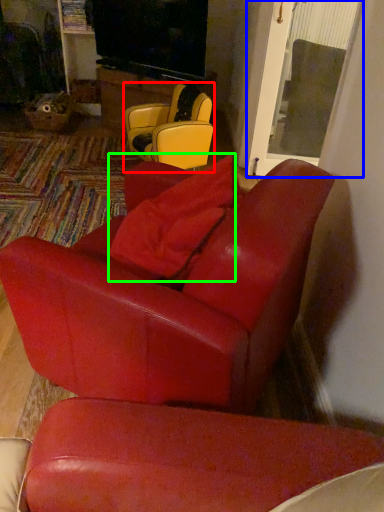
Question: Estimate the real-world distances between objects in this image. Which object is farther from chair (highlighted by a red box), glass door (highlighted by a blue box) or pillow (highlighted by a green box)?

Choices:
 (A) glass door
 (B) pillow

Answer: (B)